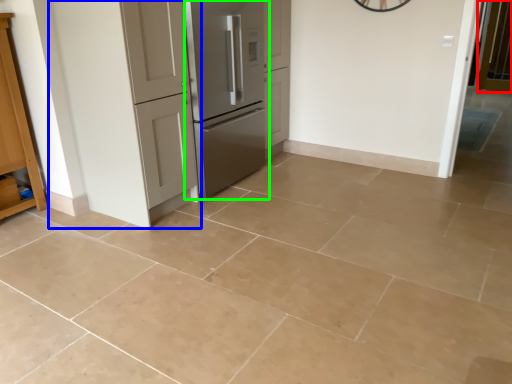
Question: Based on their relative distances, which object is farther from screen door (highlighted by a red box)? Choose from door (highlighted by a blue box) and refrigerator (highlighted by a green box).

Choices:
 (A) door
 (B) refrigerator

Answer: (A)